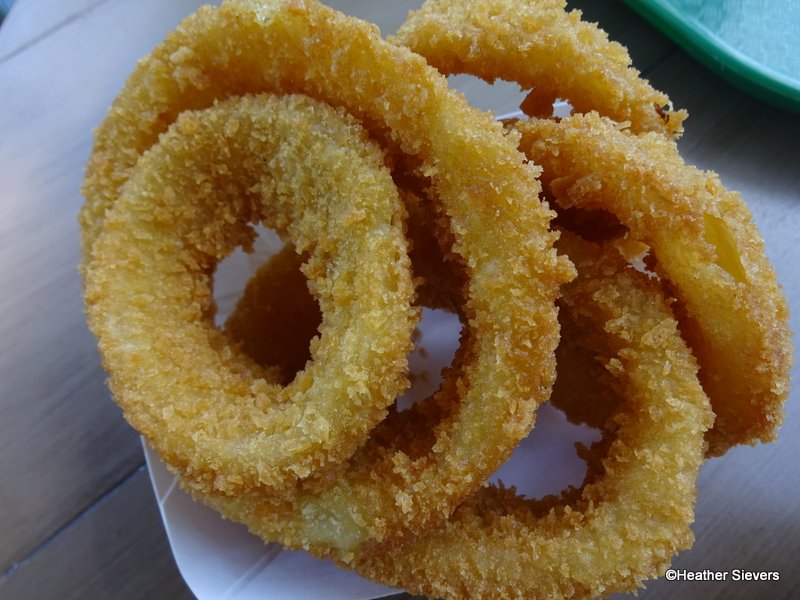
Image resolution: width=800 pixels, height=600 pixels. I want to click on edge of blue plate, so click(742, 57).